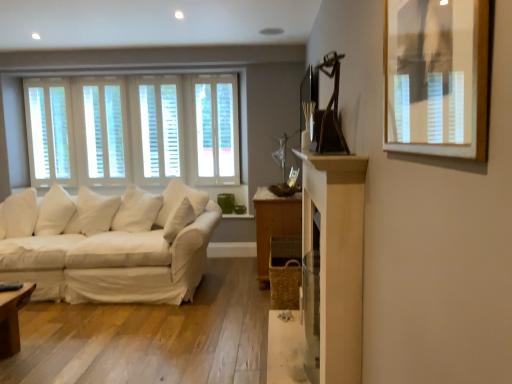
Question: Looking at their shapes, would you say white fabric couch at left is wider or thinner than white wood window at center, which is counted as the 1th window, starting from the right?

Choices:
 (A) thin
 (B) wide

Answer: (B)

Question: Based on their sizes in the image, would you say white fabric couch at left is bigger or smaller than white wood window at center, which is the 2th window from left to right?

Choices:
 (A) big
 (B) small

Answer: (A)

Question: Which object is the farthest from the white wood blinds at left, the first window in the left-to-right sequence?

Choices:
 (A) white fabric couch at left
 (B) white wood window at center, which is counted as the 1th window, starting from the right
 (C) wooden framed picture at upper right
 (D) wooden dresser at center

Answer: (C)

Question: Which object is the farthest from the wooden framed picture at upper right?

Choices:
 (A) wooden dresser at center
 (B) white wood blinds at left, arranged as the 2th window when viewed from the right
 (C) white wood window at center, which is the 2th window from left to right
 (D) white fabric couch at left

Answer: (B)